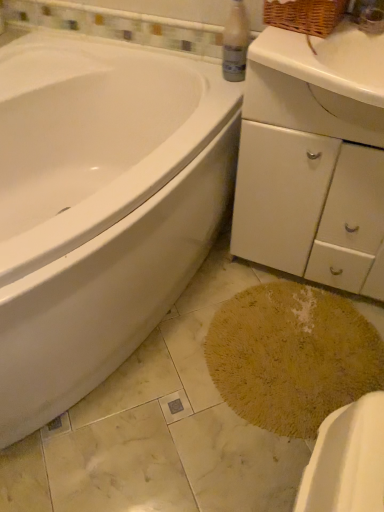
What do you see at coordinates (347, 461) in the screenshot? The image size is (384, 512). I see `yellow textured rug at lower center` at bounding box center [347, 461].

This screenshot has height=512, width=384. What do you see at coordinates (305, 15) in the screenshot?
I see `woven brown basket at upper right` at bounding box center [305, 15].

Locate an element on the screen. white matte cabinet at center-right is located at coordinates (309, 185).

What do you see at coordinates (292, 356) in the screenshot? This screenshot has width=384, height=512. I see `yellow textured bath mat at lower center` at bounding box center [292, 356].

Locate an element on the screen. The image size is (384, 512). yellow textured rug at lower center is located at coordinates (347, 461).

Considering the relative sizes of yellow textured bath mat at lower center and white matte cabinet at center-right in the image provided, is yellow textured bath mat at lower center shorter than white matte cabinet at center-right?

Indeed, yellow textured bath mat at lower center has a lesser height compared to white matte cabinet at center-right.

Is yellow textured bath mat at lower center smaller than white matte cabinet at center-right?

Yes.

Locate an element on the screen. bath mat located behind the white matte cabinet at center-right is located at coordinates (292, 356).

Is yellow textured bath mat at lower center not near white matte cabinet at center-right?

No, there isn't a large distance between yellow textured bath mat at lower center and white matte cabinet at center-right.

From a real-world perspective, which is physically below, white matte cabinet at center-right or yellow textured rug at lower center?

yellow textured rug at lower center.

Does white matte cabinet at center-right have a smaller size compared to yellow textured rug at lower center?

No.

Does white matte cabinet at center-right touch yellow textured rug at lower center?

white matte cabinet at center-right and yellow textured rug at lower center are clearly separated.

Identify the location of dresser that appears above the yellow textured rug at lower center (from a real-world perspective). (309, 185).

Is white matte cabinet at center-right positioned with its back to clear plastic bottle at upper center?

white matte cabinet at center-right is not turned away from clear plastic bottle at upper center.

Does point (377, 144) lie in front of point (231, 55)?

Yes, point (377, 144) is closer to viewer.

Is clear plastic bottle at upper center completely or partially inside white matte cabinet at center-right?

No, clear plastic bottle at upper center is not surrounded by white matte cabinet at center-right.

Can you confirm if yellow textured rug at lower center is thinner than clear plastic bottle at upper center?

No.

Based on the photo, is clear plastic bottle at upper center at the back of yellow textured rug at lower center?

That's not correct — yellow textured rug at lower center is not looking away from clear plastic bottle at upper center.

From a real-world perspective, which object rests below the other?

yellow textured rug at lower center.

Between point (339, 425) and point (242, 71), which one is positioned in front?

Positioned in front is point (339, 425).

Is clear plastic bottle at upper center positioned before yellow textured rug at lower center?

No, it is not.

Is clear plastic bottle at upper center to the left or to the right of yellow textured rug at lower center in the image?

From the image, it's evident that clear plastic bottle at upper center is to the left of yellow textured rug at lower center.

Is point (224, 45) farther from camera compared to point (313, 505)?

Yes.

From the image's perspective, is clear plastic bottle at upper center on yellow textured rug at lower center?

Yes, from the image's perspective, clear plastic bottle at upper center is above yellow textured rug at lower center.

Where is `dresser above the white glossy bathtub at left (from a real-world perspective)`? The height and width of the screenshot is (512, 384). dresser above the white glossy bathtub at left (from a real-world perspective) is located at coordinates (309, 185).

Which object is thinner, white glossy bathtub at left or white matte cabinet at center-right?

Thinner between the two is white matte cabinet at center-right.

Is white matte cabinet at center-right surrounded by white glossy bathtub at left?

Definitely not — white matte cabinet at center-right is not inside white glossy bathtub at left.

Are white glossy bathtub at left and white matte cabinet at center-right far apart?

That's not correct — white glossy bathtub at left is a little close to white matte cabinet at center-right.

From a real-world perspective, is white glossy bathtub at left physically above yellow textured rug at lower center?

Result: Yes.

Identify the location of porcelain behind the white glossy bathtub at left. (347, 461).

Is white glossy bathtub at left aimed at yellow textured rug at lower center?

Yes.

From the image's perspective, between white glossy bathtub at left and yellow textured rug at lower center, which one is located above?

white glossy bathtub at left, from the image's perspective.

This screenshot has width=384, height=512. In order to click on bath mat below the white matte cabinet at center-right (from the image's perspective) in this screenshot , I will do `click(292, 356)`.

There is a yellow textured rug at lower center. Find the location of `dresser above it (from a real-world perspective)`. dresser above it (from a real-world perspective) is located at coordinates (309, 185).

When comparing their distances from white glossy bathtub at left, does clear plastic bottle at upper center or white matte cabinet at center-right seem further?

clear plastic bottle at upper center lies further to white glossy bathtub at left than the other object.

Estimate the real-world distances between objects in this image. Which object is further from white glossy bathtub at left, woven brown basket at upper right or white matte cabinet at center-right?

woven brown basket at upper right.

Considering their positions, is white matte cabinet at center-right positioned closer to yellow textured bath mat at lower center than woven brown basket at upper right?

Based on the image, white matte cabinet at center-right appears to be nearer to yellow textured bath mat at lower center.

Looking at the image, which one is located further to white matte cabinet at center-right, woven brown basket at upper right or clear plastic bottle at upper center?

Based on the image, clear plastic bottle at upper center appears to be further to white matte cabinet at center-right.

Which object lies further to the anchor point yellow textured rug at lower center, white matte cabinet at center-right or yellow textured bath mat at lower center?

white matte cabinet at center-right is positioned further to the anchor yellow textured rug at lower center.

Looking at the image, which one is located closer to woven brown basket at upper right, yellow textured rug at lower center or clear plastic bottle at upper center?

clear plastic bottle at upper center lies closer to woven brown basket at upper right than the other object.

Considering their positions, is white glossy bathtub at left positioned further to clear plastic bottle at upper center than white matte cabinet at center-right?

white glossy bathtub at left.

Considering their positions, is yellow textured rug at lower center positioned closer to clear plastic bottle at upper center than white matte cabinet at center-right?

white matte cabinet at center-right.

Where is `bathtub that lies between woven brown basket at upper right and yellow textured bath mat at lower center from top to bottom`? bathtub that lies between woven brown basket at upper right and yellow textured bath mat at lower center from top to bottom is located at coordinates (99, 208).

At what (x,y) coordinates should I click in order to perform the action: click on cleaning product between white glossy bathtub at left and white matte cabinet at center-right from left to right. Please return your answer as a coordinate pair (x, y). This screenshot has width=384, height=512. Looking at the image, I should click on (235, 42).

The width and height of the screenshot is (384, 512). What are the coordinates of `bath mat between white glossy bathtub at left and yellow textured rug at lower center from left to right` in the screenshot? It's located at coord(292,356).

This screenshot has width=384, height=512. I want to click on bath mat located between white glossy bathtub at left and white matte cabinet at center-right in the left-right direction, so click(292, 356).